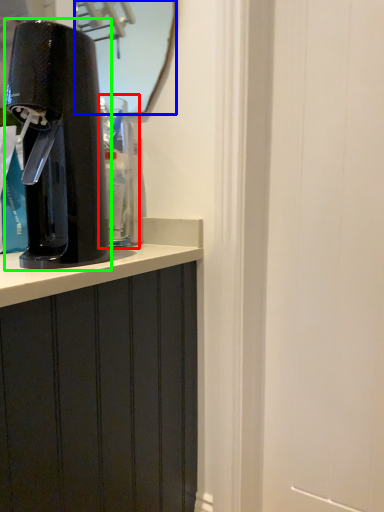
Question: Which object is positioned farthest from water cooler (highlighted by a red box)? Select from mirror (highlighted by a blue box) and home appliance (highlighted by a green box).

Choices:
 (A) mirror
 (B) home appliance

Answer: (A)